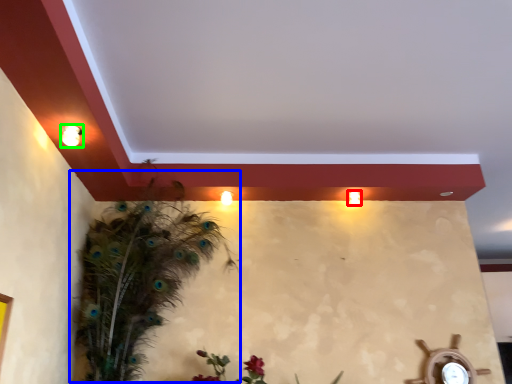
Question: Considering the real-world distances, which object is farthest from light (highlighted by a red box)? bird (highlighted by a blue box) or light fixture (highlighted by a green box)?

Choices:
 (A) bird
 (B) light fixture

Answer: (B)